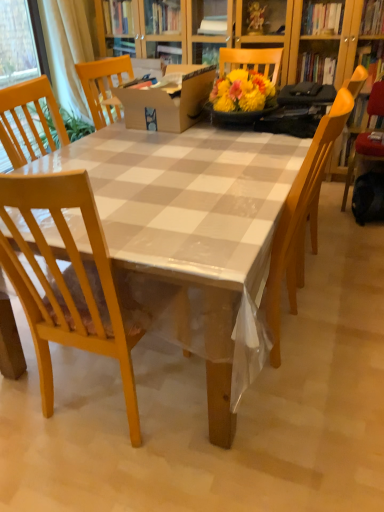
This screenshot has width=384, height=512. I want to click on vacant space in front of cardboard box at center, so click(x=184, y=148).